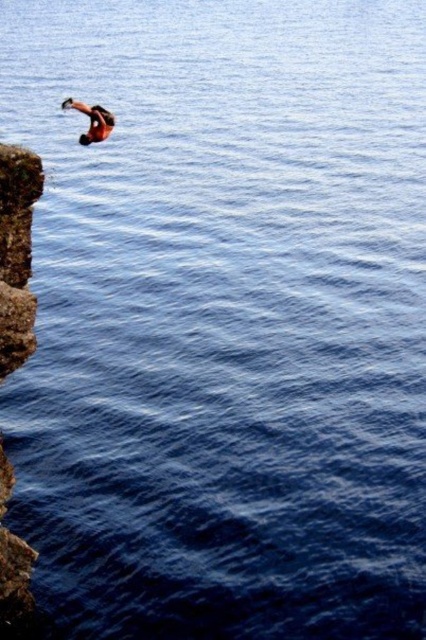
Question: Which of the following is the farthest from the observer?

Choices:
 (A) rusty rock at left
 (B) reddish-orange skin diver at upper left

Answer: (B)

Question: Is rusty rock at left positioned at the back of reddish-orange skin diver at upper left?

Choices:
 (A) no
 (B) yes

Answer: (A)

Question: Which point is closer to the camera?

Choices:
 (A) rusty rock at left
 (B) reddish-orange skin diver at upper left

Answer: (A)

Question: Among these objects, which one is farthest from the camera?

Choices:
 (A) reddish-orange skin diver at upper left
 (B) rusty rock at left

Answer: (A)

Question: Does rusty rock at left appear on the left side of reddish-orange skin diver at upper left?

Choices:
 (A) yes
 (B) no

Answer: (B)

Question: Does rusty rock at left appear under reddish-orange skin diver at upper left?

Choices:
 (A) yes
 (B) no

Answer: (A)